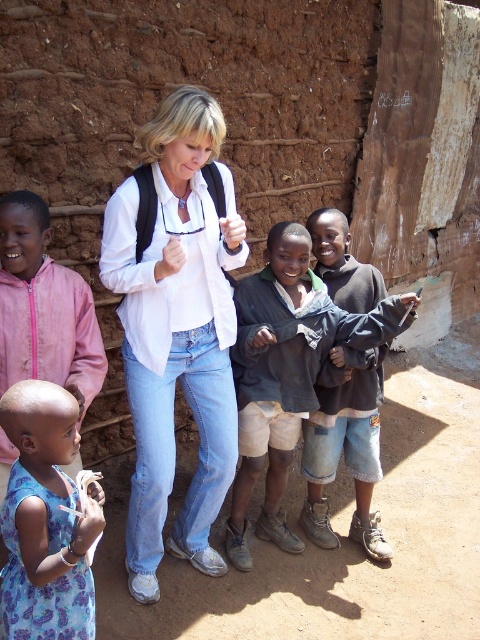
You are a photographer trying to capture a group photo of the white matte shirt at center and the blue printed dress at lower left. Since you want both subjects to appear the same size in the photo, which direction should you move your camera? Explain your reasoning based on their sizes.

The white matte shirt at center is larger in size than the blue printed dress at lower left. To make them appear the same size in the photo, you should move the camera closer to the blue printed dress at lower left and farther from the white matte shirt at center. This adjustment balances their apparent sizes by compensating for the difference in their actual sizes through distance.

Based on the photo, based on the scene description, where is the denim shorts at center positioned relative to the woman?

The denim shorts at center is located at point (346, 451), which is to the right of the woman.

You are a photographer trying to capture a candid shot of the scene. You want to ensure that both the white matte shirt at center and the blue printed dress at lower left are clearly visible in the frame. Which clothing item should you focus on first if you want to include both in your shot without moving the camera?

The white matte shirt at center is positioned under the blue printed dress at lower left, so focusing on the blue printed dress at lower left first would allow both items to be in the frame without moving the camera.